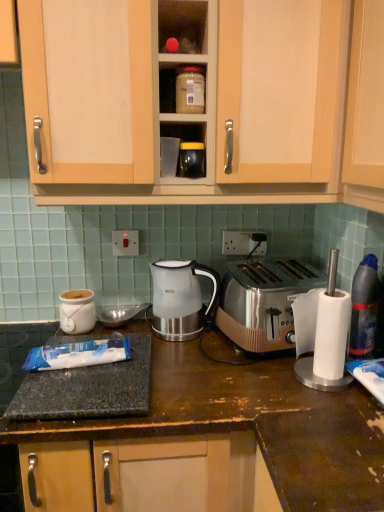
Question: Is point (79, 320) closer or farther from the camera than point (173, 317)?

Choices:
 (A) farther
 (B) closer

Answer: (A)

Question: Based on their positions, is matte white ceramic jar at left, which ranks as the 2th appliance in top-to-bottom order, located to the left or right of satin silver kettle at center?

Choices:
 (A) left
 (B) right

Answer: (A)

Question: Estimate the real-world distances between objects in this image. Which object is closer to the satin silver toaster at right?

Choices:
 (A) matte white ceramic jar at left, positioned as the second appliance in front-to-back order
 (B) white plastic socket at center, the first electric outlet from the back
 (C) matte wood cabinet at upper center
 (D) satin silver kettle at center
 (E) white plastic electric outlet at center, the 1th electric outlet positioned from the front

Answer: (D)

Question: Estimate the real-world distances between objects in this image. Which object is closer to the matte white ceramic jar at left, arranged as the 1th appliance when viewed from the left?

Choices:
 (A) white plastic electric outlet at center, the 1th electric outlet positioned from the front
 (B) white plastic socket at center, the first electric outlet from the back
 (C) satin silver kettle at center
 (D) blue glossy bottle at right
 (E) satin silver toaster at right

Answer: (A)